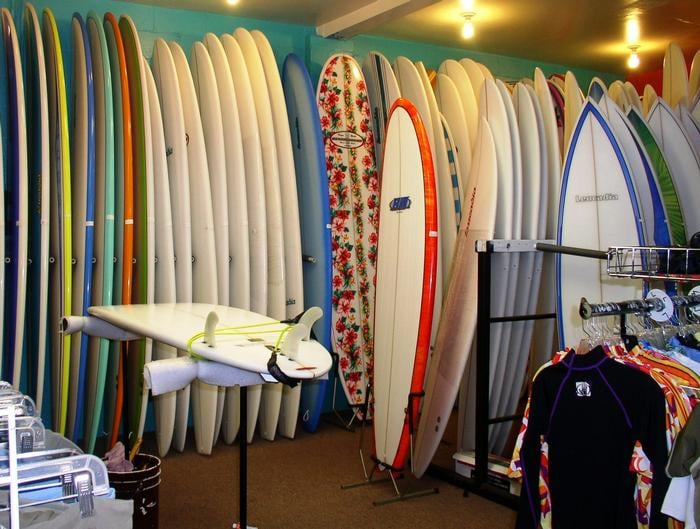
Locate an element on the screen. The width and height of the screenshot is (700, 529). wall is located at coordinates (166, 15).